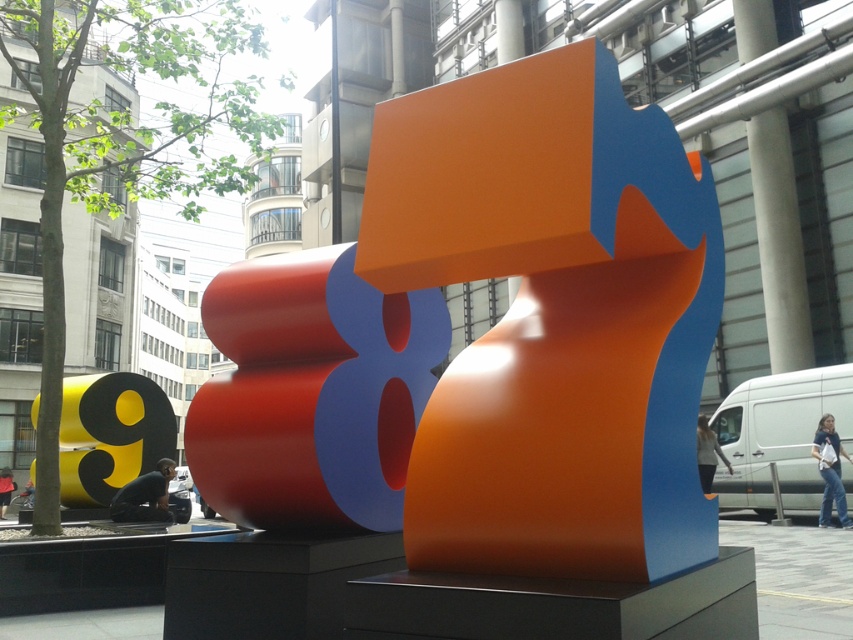
You are standing in a store and see two pairs of jeans displayed on mannequins. The jeans at lower right and the skinny jeans at center. Which pair is taller?

The jeans at lower right is taller than the skinny jeans at center.

You are standing in the urban scene looking at the jeans at lower right and the skinny jeans at center. Which pair of jeans is nearer to you?

The jeans at lower right is closer to the viewer than the skinny jeans at center.

You are standing in the city square and see the yellow glossy number at center and the jeans at lower right. Which object is higher up in the image?

The yellow glossy number at center is located above the jeans at lower right, so it is higher up in the image.